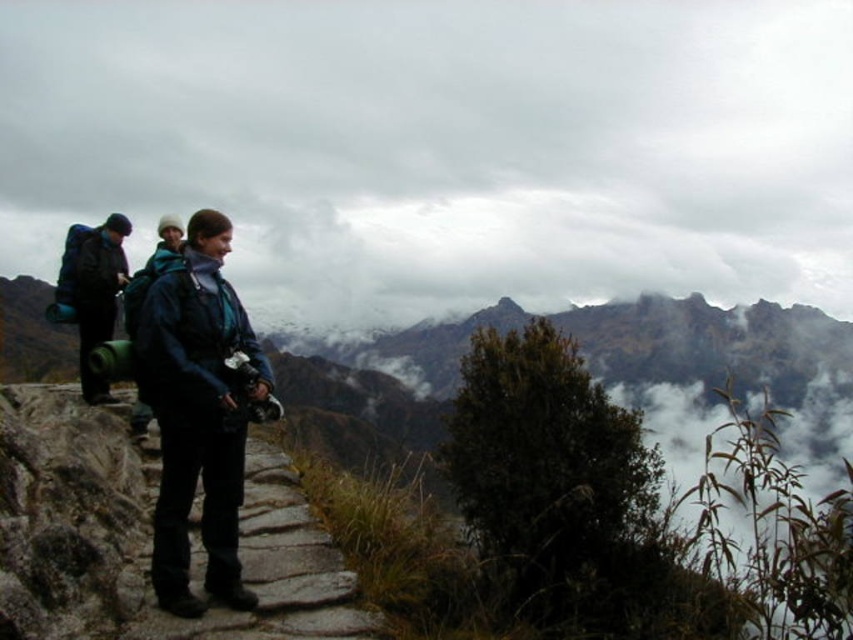
Is cloudy sky at upper center above dark blue backpack at left?

Correct, cloudy sky at upper center is located above dark blue backpack at left.

Who is lower down, cloudy sky at upper center or dark blue backpack at left?

dark blue backpack at left is below.

This screenshot has height=640, width=853. I want to click on cloudy sky at upper center, so (444, 147).

Locate an element on the screen. The width and height of the screenshot is (853, 640). cloudy sky at upper center is located at coordinates (444, 147).

Is point (198, 296) closer to viewer compared to point (126, 296)?

Yes, point (198, 296) is closer to viewer.

Between matte blue jacket at center and green fabric backpack at left, which one is positioned lower?

matte blue jacket at center is below.

Is point (183, 340) positioned before point (138, 282)?

Yes, it is in front of point (138, 282).

What are the coordinates of `matte blue jacket at center` in the screenshot? It's located at (196, 413).

Which is behind, point (293, 548) or point (73, 260)?

The point (73, 260) is more distant.

Does stone paved path at center appear under dark blue backpack at left?

Yes.

Looking at this image, who is more forward, (x=35, y=424) or (x=86, y=298)?

Positioned in front is point (x=35, y=424).

Where is `stone paved path at center`? The height and width of the screenshot is (640, 853). stone paved path at center is located at coordinates (143, 536).